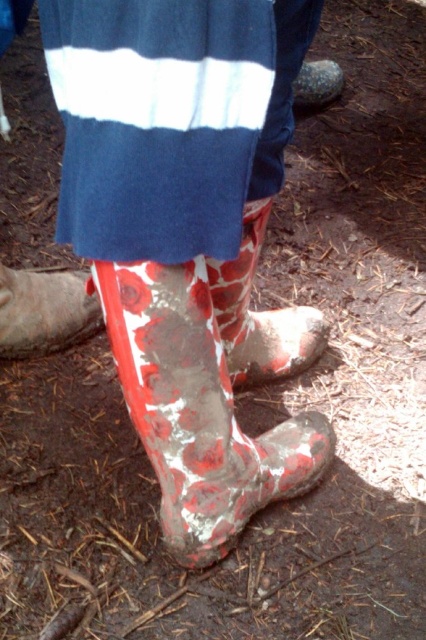
You are a photographer trying to capture a shot of the shiny metallic rock at upper center without the matte rubber boot at lower left blocking it. Based on their positions, can you adjust your camera angle to the right to avoid the boot?

The matte rubber boot at lower left is to the left of the shiny metallic rock at upper center, so adjusting the camera angle to the right should allow you to capture the shiny metallic rock at upper center without the boot blocking it.

You are standing in a muddy area and need to place a marker exactly at the position of the reddish matte rubber boot at lower center. What are the coordinates where you should place the marker?

The coordinates for the reddish matte rubber boot at lower center are at point (259, 314).

You are a delivery robot with a height of 1.5 meters. You need to deliver a package to the shiny metallic rock at upper center. There is a matte rubber boot at lower left in the way. Can you go over it?

The distance between the matte rubber boot at lower left and the shiny metallic rock at upper center is 1.20 meters. Since the robot is 1.5 meters tall, it can easily go over the matte rubber boot at lower left to reach the shiny metallic rock at upper center.